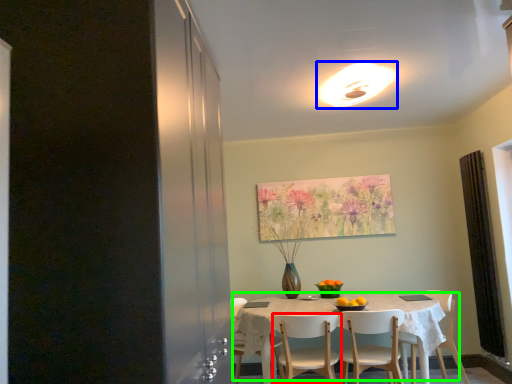
Question: Which object is the closest to the chair (highlighted by a red box)? Choose among these: light fixture (highlighted by a blue box) or kitchen & dining room table (highlighted by a green box).

Choices:
 (A) light fixture
 (B) kitchen & dining room table

Answer: (B)